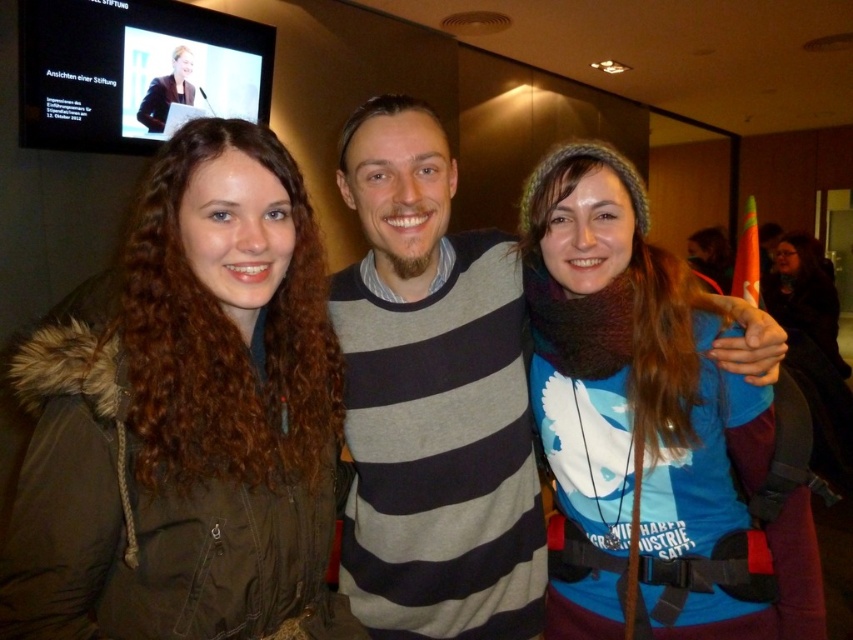
You are standing at the point marked by the coordinates point (184, 164) and want to take a photo of the three people in the scene. Considering your position, will you be able to capture all three individuals in the frame without moving? Please explain your reasoning.

The point (184, 164) is 34.81 inches away from the viewer. Since the three people are positioned in a group facing the camera, and the distance is sufficient to encompass their group arrangement, you should be able to capture all three individuals in the frame without moving.